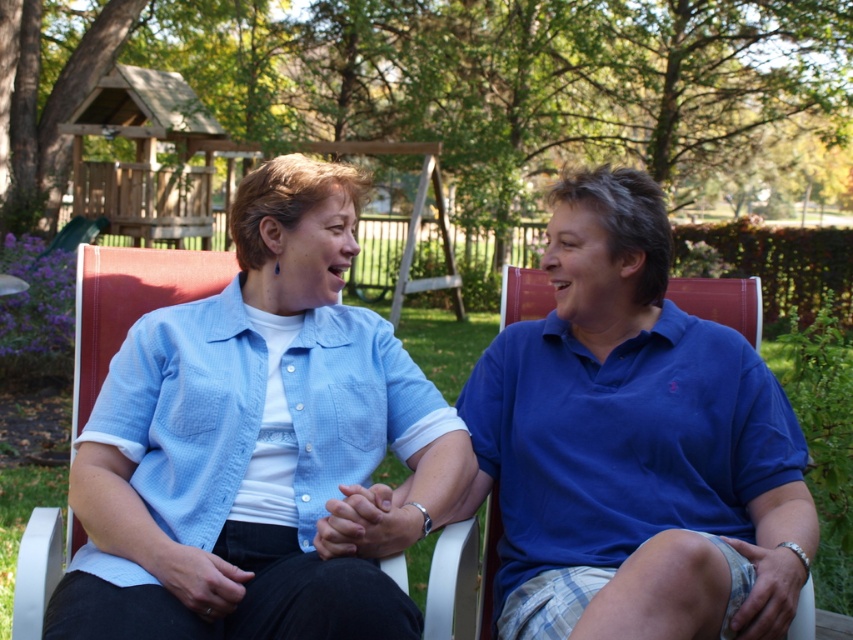
In the scene shown: Does light blue fabric shirt at center have a smaller size compared to blue cotton polo shirt at center?

Yes, light blue fabric shirt at center is smaller than blue cotton polo shirt at center.

Can you confirm if light blue fabric shirt at center is bigger than blue cotton polo shirt at center?

Actually, light blue fabric shirt at center might be smaller than blue cotton polo shirt at center.

Measure the distance between light blue fabric shirt at center and camera.

light blue fabric shirt at center is 1.64 meters away from camera.

In order to click on light blue fabric shirt at center in this screenshot , I will do `click(259, 445)`.